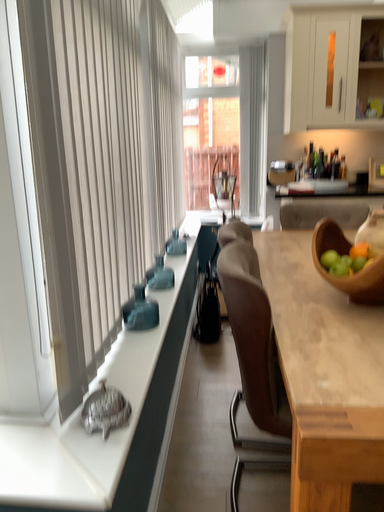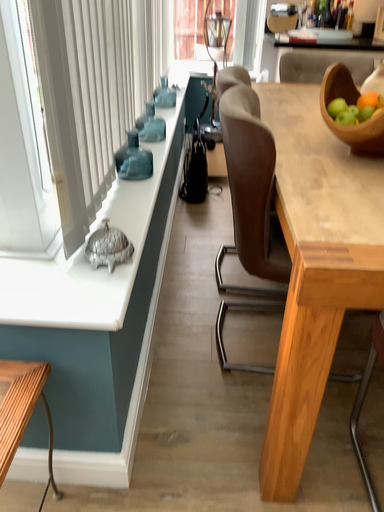
Question: Which way did the camera rotate in the video?

Choices:
 (A) rotated upward
 (B) rotated downward

Answer: (B)